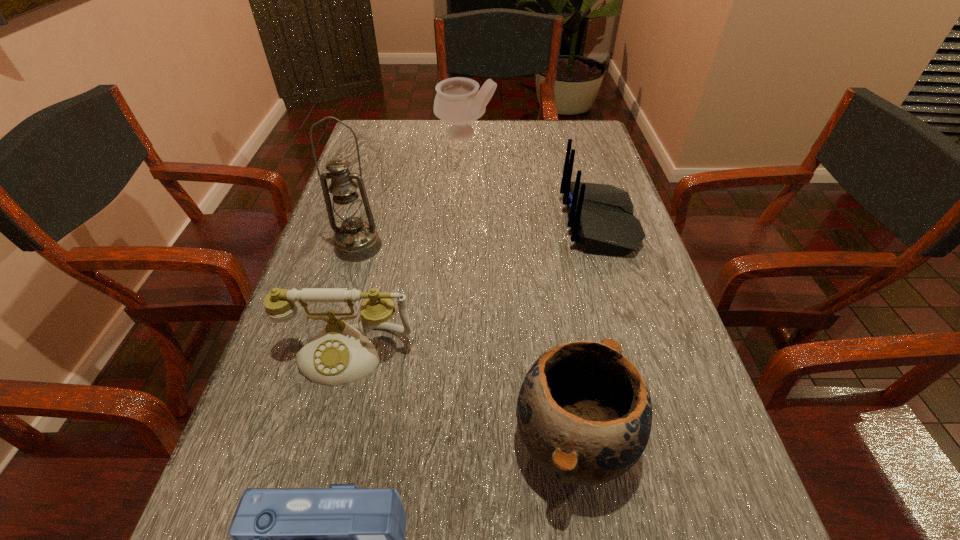
Find the location of a particular element. the tallest object is located at coordinates (355, 240).

Identify the location of the farthest object. (458, 101).

What are the coordinates of `the farther pottery` in the screenshot? It's located at (458, 101).

This screenshot has width=960, height=540. What are the coordinates of `router` in the screenshot? It's located at (601, 217).

The width and height of the screenshot is (960, 540). I want to click on the fifth farthest object, so click(584, 412).

The height and width of the screenshot is (540, 960). I want to click on the right pottery, so click(x=584, y=412).

Where is `telephone`? The width and height of the screenshot is (960, 540). telephone is located at coordinates (339, 354).

The height and width of the screenshot is (540, 960). In order to click on vacant area situated 0.270m on the back of the oil lamp in this screenshot , I will do `click(380, 171)`.

Image resolution: width=960 pixels, height=540 pixels. What are the coordinates of `vacant space located 0.180m on the front of the farther pottery` in the screenshot? It's located at (464, 179).

This screenshot has width=960, height=540. I want to click on vacant space located 0.320m on the back of the router, so click(433, 224).